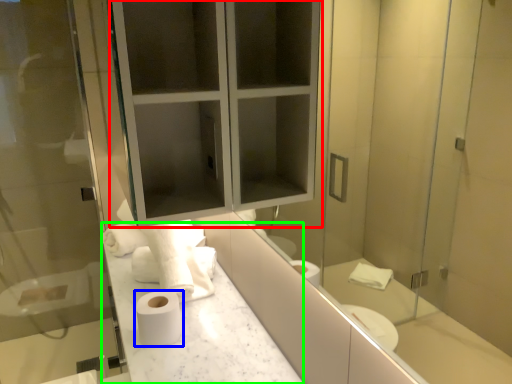
Question: Which is nearer to the medicine cabinet (highlighted by a red box)? toilet paper (highlighted by a blue box) or counter top (highlighted by a green box).

Choices:
 (A) toilet paper
 (B) counter top

Answer: (B)